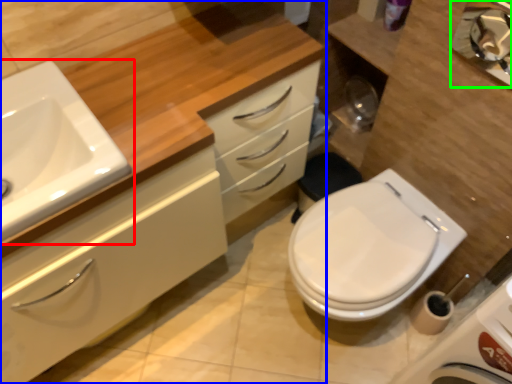
Question: Estimate the real-world distances between objects in this image. Which object is farther from sink (highlighted by a red box), bathroom cabinet (highlighted by a blue box) or mirror (highlighted by a green box)?

Choices:
 (A) bathroom cabinet
 (B) mirror

Answer: (B)